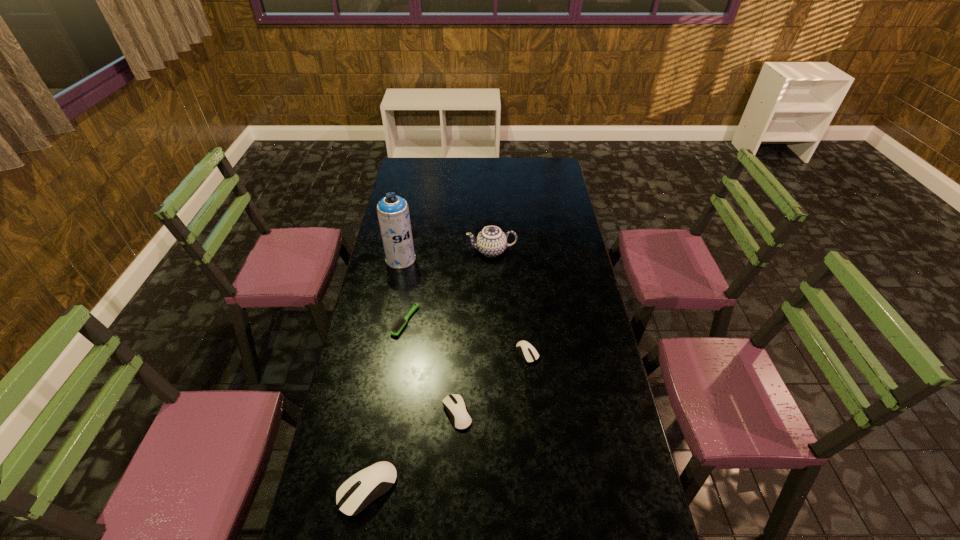
You are a GUI agent. You are given a task and a screenshot of the screen. Output one action in this format:
    pyautogui.click(x=<x>, y=<y>)
    Task: Click on the free space located on the back of the second mouse from right to left
    
    Given the screenshot: What is the action you would take?
    pyautogui.click(x=459, y=370)

Where is `free location located 0.090m on the front of the rightmost mouse`? The image size is (960, 540). free location located 0.090m on the front of the rightmost mouse is located at coordinates (531, 386).

You are a GUI agent. You are given a task and a screenshot of the screen. Output one action in this format:
    pyautogui.click(x=<x>, y=<y>)
    Task: Click on the free spot located 0.220m on the right of the aerosol can
    This screenshot has width=960, height=540.
    Given the screenshot: What is the action you would take?
    pyautogui.click(x=466, y=259)

I want to click on free spot located 0.370m from the spout of the fifth shortest object, so click(x=384, y=251).

The height and width of the screenshot is (540, 960). Find the location of `vacant point located 0.150m from the spout of the fifth shortest object`. vacant point located 0.150m from the spout of the fifth shortest object is located at coordinates (433, 251).

This screenshot has height=540, width=960. Identify the location of vacant space located from the spout of the fifth shortest object. (411, 251).

At what (x,y) coordinates should I click in order to perform the action: click on vacant space positioned on the front of the fourth nearest object. Please return your answer as a coordinate pair (x, y). The image size is (960, 540). Looking at the image, I should click on (389, 424).

In order to click on object present at the near edge in this screenshot , I will do `click(375, 480)`.

Where is `mouse that is positioned at the left edge`? mouse that is positioned at the left edge is located at coordinates (375, 480).

Where is `aerosol can that is at the left edge`? Image resolution: width=960 pixels, height=540 pixels. aerosol can that is at the left edge is located at coordinates (393, 212).